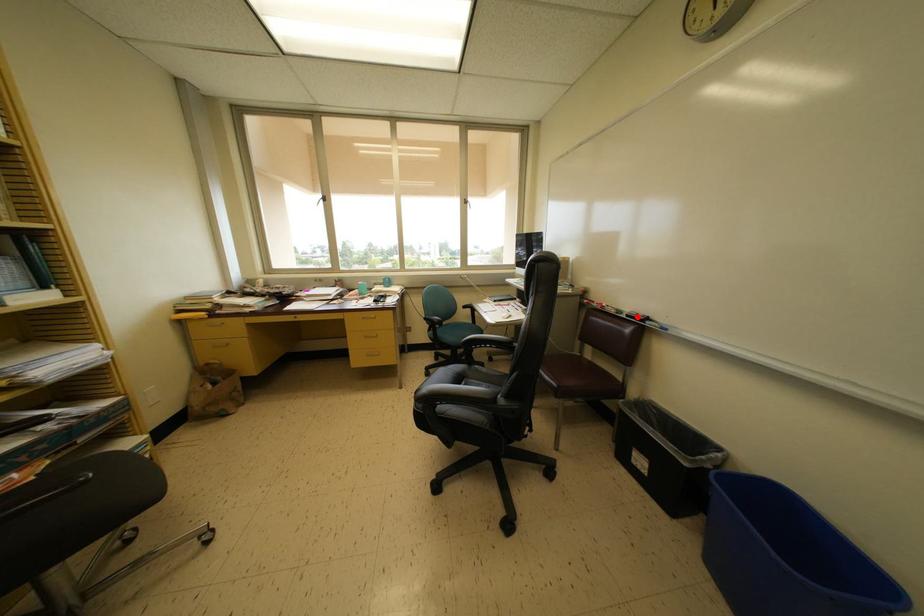
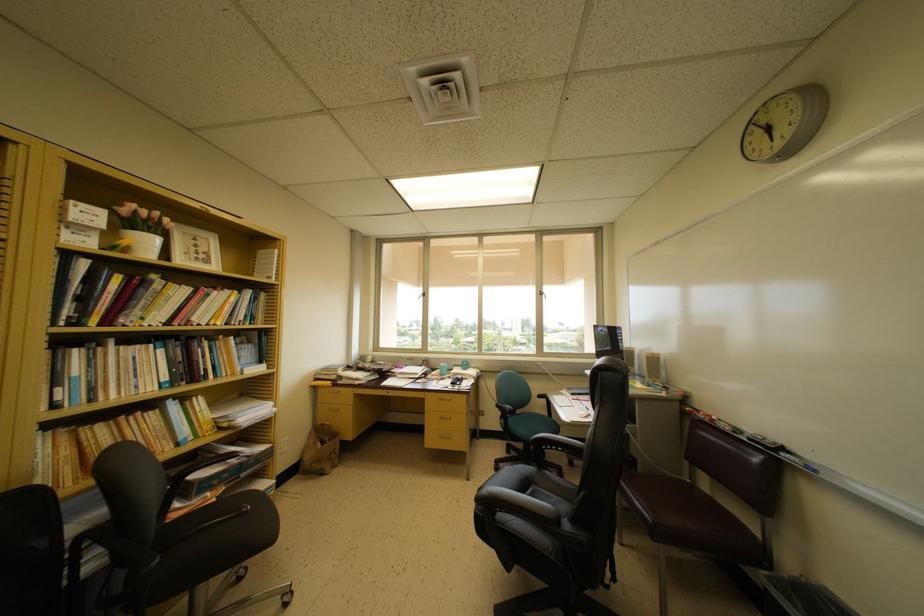
Where in the second image is the point corresponding to the highlighted location from the first image?

(762, 440)